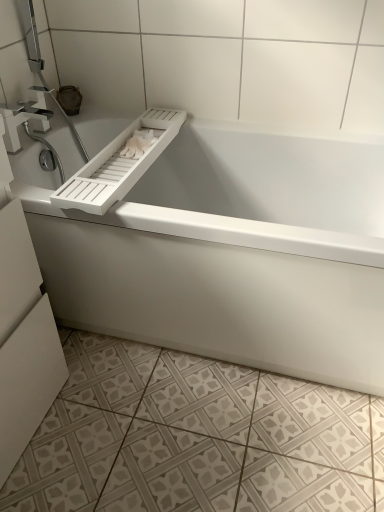
Question: Is satin nickel faucet at upper left inside the boundaries of white matte toilet paper at upper center, or outside?

Choices:
 (A) outside
 (B) inside

Answer: (A)

Question: Is satin nickel faucet at upper left taller or shorter than white matte toilet paper at upper center?

Choices:
 (A) short
 (B) tall

Answer: (B)

Question: Considering the real-world distances, which object is closest to the white textured tile at lower center?

Choices:
 (A) white matte bathtub at center
 (B) white matte toilet paper at upper center
 (C) satin nickel faucet at upper left

Answer: (A)

Question: Which of these objects is positioned farthest from the white matte toilet paper at upper center?

Choices:
 (A) satin nickel faucet at upper left
 (B) white matte bathtub at center
 (C) white textured tile at lower center

Answer: (C)